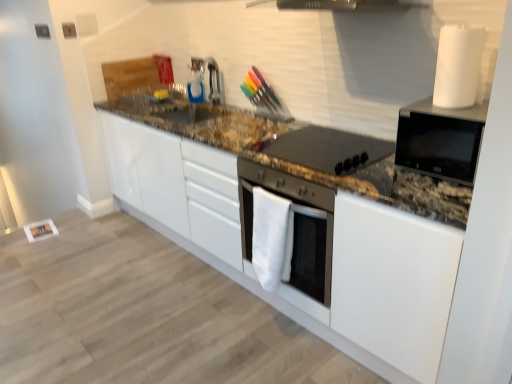
Image resolution: width=512 pixels, height=384 pixels. What are the coordinates of `vacant region to the left of black glossy microwave at upper right, placed as the first home appliance when sorted from right to left` in the screenshot? It's located at (384, 172).